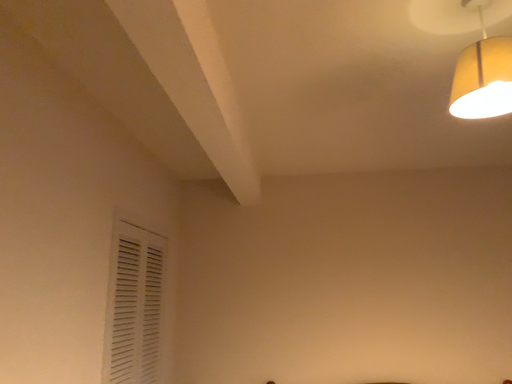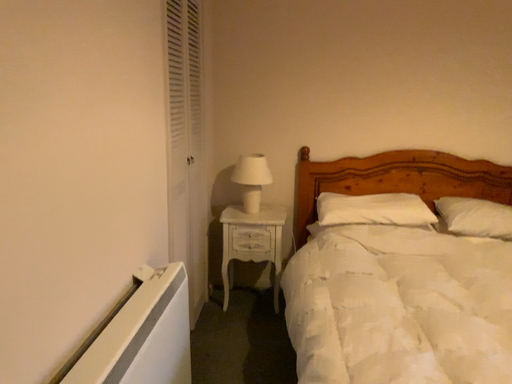
Question: Which way did the camera rotate in the video?

Choices:
 (A) rotated downward
 (B) rotated upward

Answer: (A)